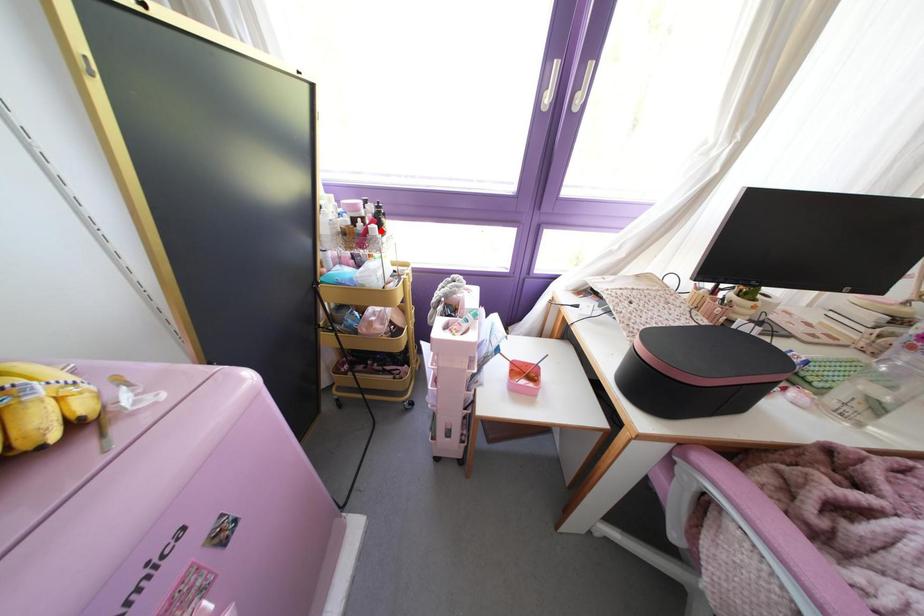
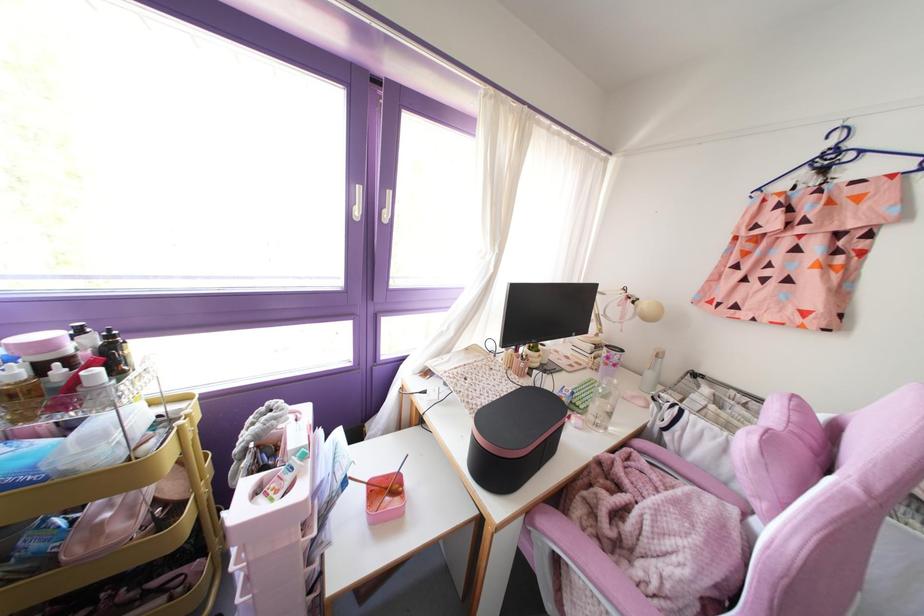
Question: I am providing you with two images of the same scene from different viewpoints. In image1, a red point is highlighted. Considering the same 3D point in image2, which of the following is correct?

Choices:
 (A) It is closer
 (B) It is farther

Answer: (B)